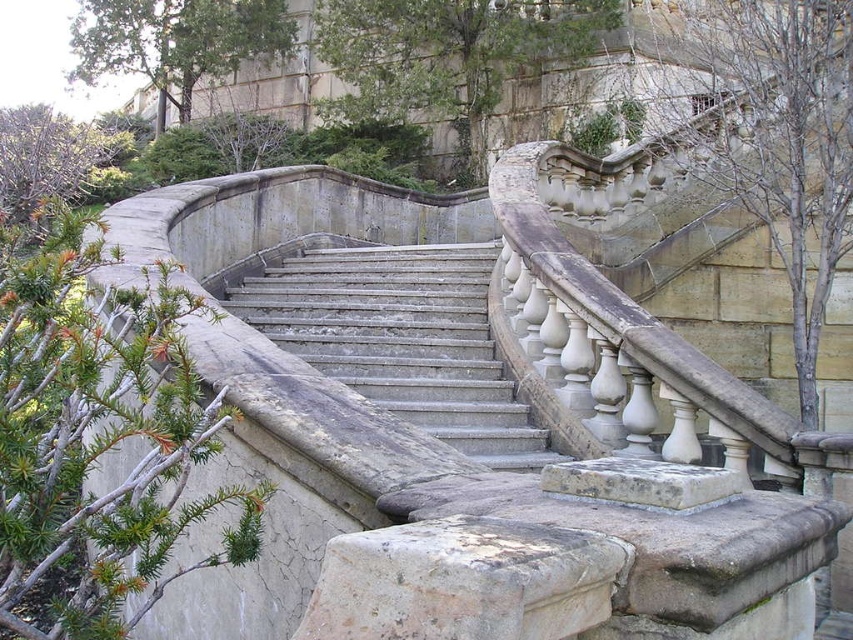
You are standing at the base of the stairs and want to place a small potted plant between the two points, point (378, 17) and point (96, 168). Which point is closer to you so that you can easily reach it without moving further up the stairs?

Point (378, 17) is closer to you than point (96, 168), so you can easily reach it without moving further up the stairs.

In the scene shown: You are a landscape architect designing a pathway between the green leafy tree at upper center and the green leafy bush at upper left. Given that the pathway must be 6 meters long, will it be possible to fit it between them?

The distance between the green leafy tree at upper center and the green leafy bush at upper left is 6.33 meters. Since the required pathway length is 6 meters, it will fit comfortably between them with some extra space remaining.